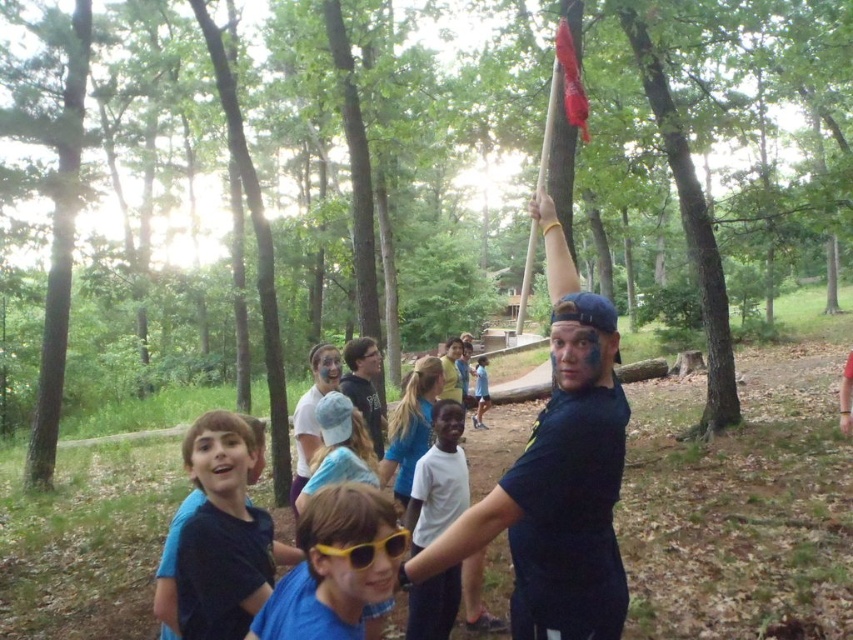
Question: Is dark blue t-shirt at center bigger than light blue shirt at center?

Choices:
 (A) yes
 (B) no

Answer: (A)

Question: Which point is farther to the camera?

Choices:
 (A) (601, 481)
 (B) (292, 488)

Answer: (B)

Question: Which object appears farthest from the camera in this image?

Choices:
 (A) matte blue face paint at center
 (B) white matte shirt at center
 (C) yellow plastic goggles at center
 (D) blue matte shirt at lower left

Answer: (A)

Question: Does white matte shirt at center appear on the left side of yellow plastic goggles at center?

Choices:
 (A) no
 (B) yes

Answer: (A)

Question: Does blue matte shirt at lower left appear over yellow plastic goggles at center?

Choices:
 (A) yes
 (B) no

Answer: (B)

Question: Which of the following is the closest to the observer?

Choices:
 (A) matte blue shirt at center
 (B) blue matte shirt at lower left
 (C) matte blue face paint at center
 (D) white matte shirt at center

Answer: (B)